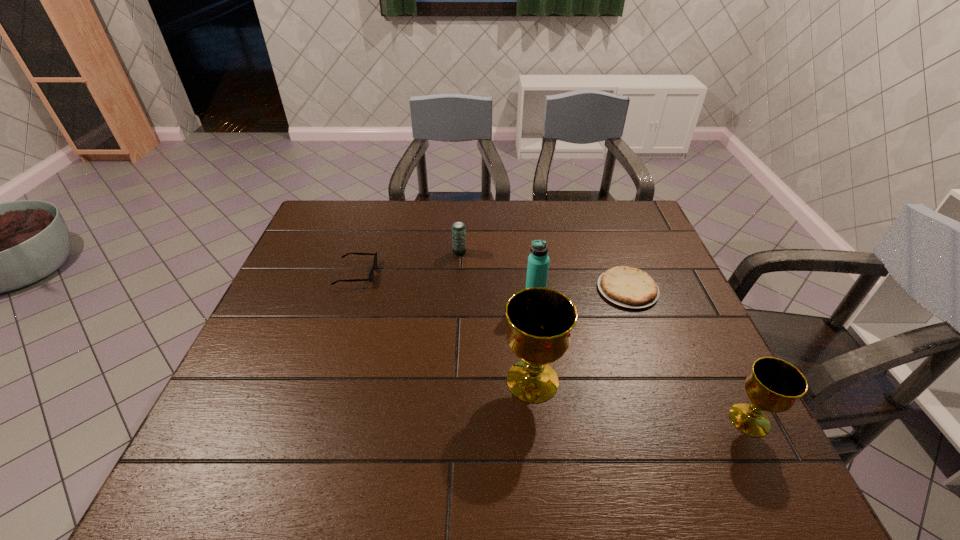
The image size is (960, 540). Find the location of `the taller chalice`. the taller chalice is located at coordinates (540, 320).

This screenshot has width=960, height=540. I want to click on the left chalice, so pyautogui.click(x=540, y=320).

This screenshot has height=540, width=960. I want to click on the right chalice, so click(x=774, y=385).

Find the location of a particular element. The height and width of the screenshot is (540, 960). the shorter chalice is located at coordinates (774, 385).

The height and width of the screenshot is (540, 960). Find the location of `the fifth object from right to left`. the fifth object from right to left is located at coordinates [458, 228].

Find the location of `the third shortest object`. the third shortest object is located at coordinates pos(458,228).

Where is `the second tallest object`? This screenshot has width=960, height=540. the second tallest object is located at coordinates (538, 261).

Find the location of a particular element. Image resolution: width=960 pixels, height=540 pixels. tortilla is located at coordinates (629, 287).

Locate an element on the screen. This screenshot has height=540, width=960. the fifth object from left to right is located at coordinates (629, 287).

Find the location of a particular element. sunglasses is located at coordinates (371, 274).